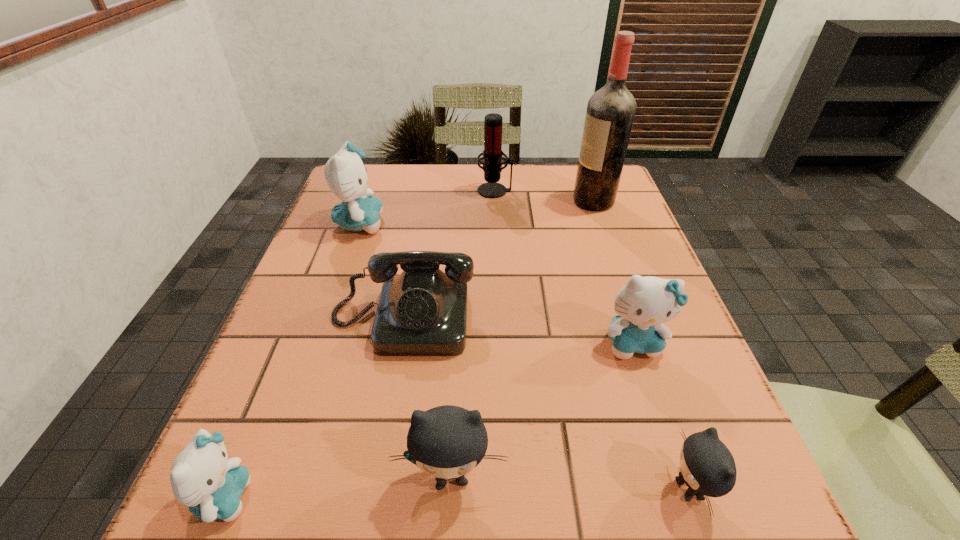
The width and height of the screenshot is (960, 540). I want to click on free space between the right gray kitten and the second biggest blue kitten, so (x=661, y=416).

Where is `free point between the bigger gray kitten and the second farthest blue kitten`? The width and height of the screenshot is (960, 540). free point between the bigger gray kitten and the second farthest blue kitten is located at coordinates (542, 409).

The height and width of the screenshot is (540, 960). What are the coordinates of `free spot between the second smallest blue kitten and the red microphone` in the screenshot? It's located at (564, 267).

Where is `unoccupied area between the black telephone and the smallest blue kitten`? The image size is (960, 540). unoccupied area between the black telephone and the smallest blue kitten is located at coordinates (314, 408).

At what (x,y) coordinates should I click in order to perform the action: click on free space that is in between the telephone and the right gray kitten. Please return your answer as a coordinate pair (x, y). Looking at the image, I should click on (546, 404).

Find the location of a particular element. The width and height of the screenshot is (960, 540). free space that is in between the third kitten from right to left and the smaller gray kitten is located at coordinates (570, 482).

The width and height of the screenshot is (960, 540). I want to click on object that stands as the second closest to the third kitten from right to left, so click(x=202, y=477).

Select which object is the seventh closest to the red microphone. Please provide its 2D coordinates. Your answer should be formatted as a tuple, i.e. [(x, y)], where the tuple contains the x and y coordinates of a point satisfying the conditions above.

[(202, 477)]

Select which kitten is the second closest to the telephone. Please provide its 2D coordinates. Your answer should be formatted as a tuple, i.e. [(x, y)], where the tuple contains the x and y coordinates of a point satisfying the conditions above.

[(448, 442)]

Locate an element on the screen. Image resolution: width=960 pixels, height=540 pixels. kitten that is the closest to the rightmost blue kitten is located at coordinates (707, 467).